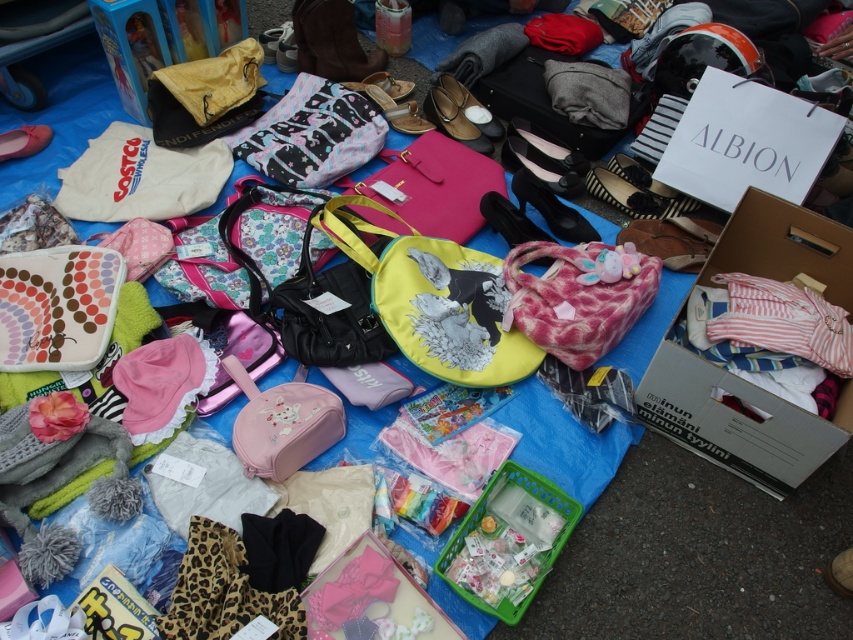
You are a customer at the market and want to choose between the yellow fabric bag at center and the fluffy pink bag at center. Which bag is wider?

The yellow fabric bag at center is wider than the fluffy pink bag at center.

What is located at the coordinates point (57, 307) in the market scene?

The point (57, 307) is occupied by a matte fabric bag at center left.